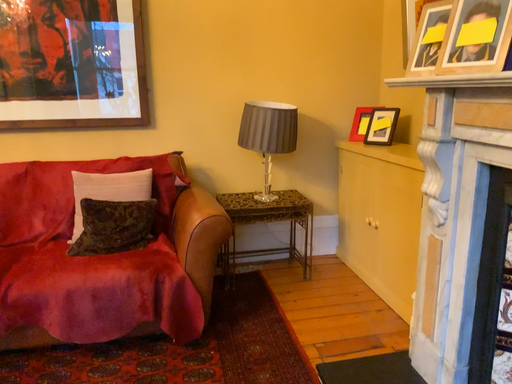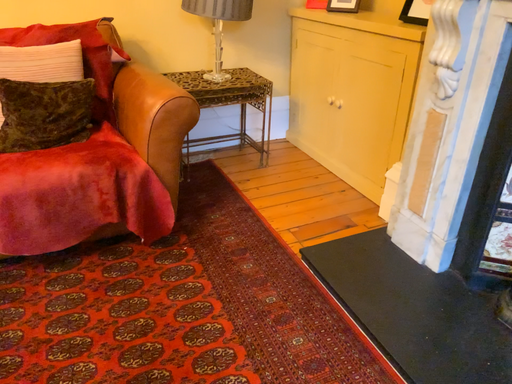
Question: Which way did the camera rotate in the video?

Choices:
 (A) rotated upward
 (B) rotated downward

Answer: (B)